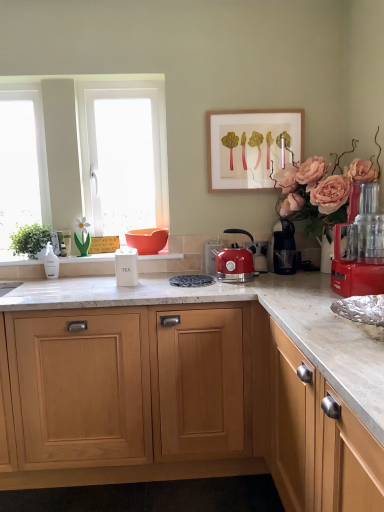
Locate an element on the screen. vacant space in front of white glossy bottle at left, which appears as the 5th kitchen appliance when viewed from the right is located at coordinates (47, 283).